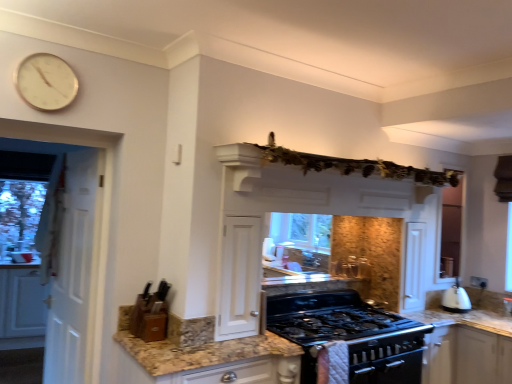
Describe the element at coordinates (73, 267) in the screenshot. I see `white wooden door at left` at that location.

Image resolution: width=512 pixels, height=384 pixels. What do you see at coordinates (46, 82) in the screenshot?
I see `white wooden clock at upper left` at bounding box center [46, 82].

This screenshot has height=384, width=512. Describe the element at coordinates (22, 303) in the screenshot. I see `white matte cabinet at left` at that location.

The image size is (512, 384). I want to click on granite at left, so (197, 349).

The width and height of the screenshot is (512, 384). Find the location of `white wooden door at left`. white wooden door at left is located at coordinates (73, 267).

In the image, is white matte exhaust hood at upper center positioned in front of or behind white wooden clock at upper left?

white matte exhaust hood at upper center is in front of white wooden clock at upper left.

Is white matte exhaust hood at upper center taller than white wooden clock at upper left?

No, white matte exhaust hood at upper center is not taller than white wooden clock at upper left.

From the image's perspective, between white matte exhaust hood at upper center and white wooden clock at upper left, who is located below?

white matte exhaust hood at upper center, from the image's perspective.

Does white matte exhaust hood at upper center have a greater width compared to white wooden clock at upper left?

Yes.

From a real-world perspective, does black matte gas stove at center, arranged as the 1th appliance when viewed from the right, sit lower than white wooden clock at upper left?

Yes.

Relative to white wooden clock at upper left, is black matte gas stove at center, acting as the 2th appliance starting from the top, in front or behind?

black matte gas stove at center, acting as the 2th appliance starting from the top, is positioned farther from the viewer than white wooden clock at upper left.

Which is behind, point (280, 326) or point (51, 91)?

The point (280, 326) is more distant.

Who is taller, black matte gas stove at center, arranged as the 1th appliance when viewed from the right, or white wooden clock at upper left?

black matte gas stove at center, arranged as the 1th appliance when viewed from the right.

Considering the relative sizes of white wooden clock at upper left and white glossy kettle at right in the image provided, is white wooden clock at upper left shorter than white glossy kettle at right?

No.

You are a GUI agent. You are given a task and a screenshot of the screen. Output one action in this format:
    pyautogui.click(x=<x>, y=<y>)
    Task: Click on the kitchen appliance lying behind the white wooden clock at upper left
    
    Given the screenshot: What is the action you would take?
    pyautogui.click(x=456, y=300)

Does point (21, 67) lie behind point (451, 291)?

No, (21, 67) is closer to viewer.

Does granite at left turn towards black matte gas stove at center, acting as the 2th appliance starting from the top?

No, granite at left is not oriented towards black matte gas stove at center, acting as the 2th appliance starting from the top.

In terms of size, does granite at left appear bigger or smaller than black matte gas stove at center, positioned as the 2th appliance in left-to-right order?

granite at left is smaller than black matte gas stove at center, positioned as the 2th appliance in left-to-right order.

Considering the sizes of objects granite at left and black matte gas stove at center, positioned as the 2th appliance in left-to-right order, in the image provided, who is wider, granite at left or black matte gas stove at center, positioned as the 2th appliance in left-to-right order,?

granite at left is wider.

Is granite at left to the left of black matte gas stove at center, arranged as the 1th appliance when viewed from the right, from the viewer's perspective?

Indeed, granite at left is positioned on the left side of black matte gas stove at center, arranged as the 1th appliance when viewed from the right.

Is granite at left in contact with white wooden door at left?

No, granite at left is not in contact with white wooden door at left.

Does granite at left have a greater height compared to white wooden door at left?

Incorrect, the height of granite at left is not larger of that of white wooden door at left.

Between granite at left and white wooden door at left, which one has larger width?

granite at left is wider.

Can white wooden door at left be found inside white wooden clock at upper left?

No, white wooden door at left is located outside of white wooden clock at upper left.

From the image's perspective, who appears lower, white wooden clock at upper left or white wooden door at left?

From the image's view, white wooden door at left is below.

Is white wooden clock at upper left far from white wooden door at left?

That's not correct — white wooden clock at upper left is a little close to white wooden door at left.

Is white wooden clock at upper left facing away from white wooden door at left?

No.

Locate an element on the screen. The image size is (512, 384). cabinetry below the white wooden door at left (from a real-world perspective) is located at coordinates (22, 303).

Are white wooden door at left and white matte cabinet at left beside each other?

They are not placed beside each other.

In terms of height, does white wooden door at left look taller or shorter compared to white matte cabinet at left?

Clearly, white wooden door at left is taller compared to white matte cabinet at left.

What's the angular difference between white wooden door at left and white matte cabinet at left's facing directions?

The angular difference between white wooden door at left and white matte cabinet at left is 73.8 degrees.

Locate an element on the screen. This screenshot has width=512, height=384. exhaust hood in front of the white wooden clock at upper left is located at coordinates (317, 187).

From the image's perspective, count 2nd appliances downward from the white wooden clock at upper left and point to it. Please provide its 2D coordinates.

[(350, 335)]

Considering their positions, is white matte cabinet at left positioned closer to white wooden clock at upper left than white glossy kettle at right?

white matte cabinet at left is positioned closer to the anchor white wooden clock at upper left.

When comparing their distances from wooden knife block at lower left, the first appliance in the top-to-bottom sequence, does white matte cabinet at left or white wooden clock at upper left seem further?

Based on the image, white matte cabinet at left appears to be further to wooden knife block at lower left, the first appliance in the top-to-bottom sequence.

From the image, which object appears to be farther from granite at left, white wooden clock at upper left or white matte cabinet at left?

white matte cabinet at left lies further to granite at left than the other object.

Estimate the real-world distances between objects in this image. Which object is further from wooden knife block at lower left, the 2th appliance when ordered from bottom to top, white wooden clock at upper left or black matte gas stove at center, which ranks as the 1th appliance in bottom-to-top order?

Based on the image, white wooden clock at upper left appears to be further to wooden knife block at lower left, the 2th appliance when ordered from bottom to top.

Looking at the image, which one is located further to black matte gas stove at center, acting as the 2th appliance starting from the top, granite at left or wooden knife block at lower left, the 2th appliance when ordered from bottom to top?

wooden knife block at lower left, the 2th appliance when ordered from bottom to top.

Looking at the image, which one is located further to granite at left, black matte gas stove at center, arranged as the 1th appliance when viewed from the right, or white wooden clock at upper left?

Based on the image, white wooden clock at upper left appears to be further to granite at left.

Which object lies further to the anchor point white wooden door at left, black matte gas stove at center, acting as the 2th appliance starting from the top, or white glossy kettle at right?

white glossy kettle at right.

Estimate the real-world distances between objects in this image. Which object is further from granite at left, white matte exhaust hood at upper center or wooden knife block at lower left, the first appliance in the top-to-bottom sequence?

Among the two, white matte exhaust hood at upper center is located further to granite at left.

Identify the location of countertop between white matte exhaust hood at upper center and black matte gas stove at center, which ranks as the 1th appliance in bottom-to-top order, vertically. (197, 349).

At what (x,y) coordinates should I click in order to perform the action: click on door positioned between granite at left and white matte cabinet at left from near to far. Please return your answer as a coordinate pair (x, y). Looking at the image, I should click on (73, 267).

Locate an element on the screen. countertop between white wooden door at left and black matte gas stove at center, arranged as the 1th appliance when viewed from the right, from left to right is located at coordinates (197, 349).

I want to click on countertop situated between white matte cabinet at left and white matte exhaust hood at upper center from left to right, so click(197, 349).